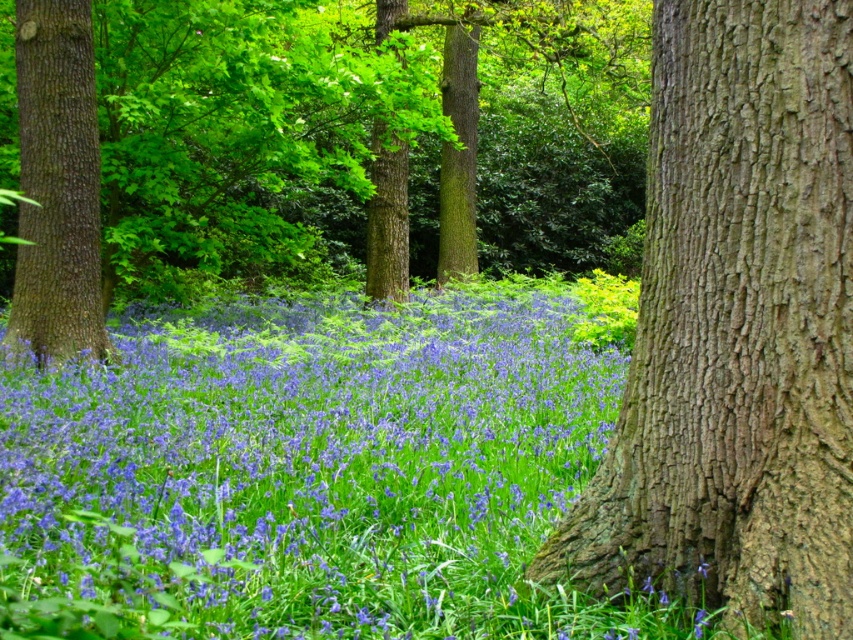
Question: Can you confirm if blue matte flowers at center is smaller than smooth brown bark at center?

Choices:
 (A) yes
 (B) no

Answer: (B)

Question: Which point is closer to the camera?

Choices:
 (A) smooth brown tree trunk at center
 (B) smooth brown bark at center
 (C) blue matte flowers at center
 (D) smooth brown tree trunk at left

Answer: (C)

Question: Which of the following is the farthest from the observer?

Choices:
 (A) (42, 51)
 (B) (751, 147)
 (C) (419, 115)

Answer: (C)

Question: Among these objects, which one is farthest from the camera?

Choices:
 (A) blue matte flowers at center
 (B) smooth brown tree trunk at center
 (C) smooth brown bark at center

Answer: (B)

Question: Does blue matte flowers at center appear on the right side of smooth brown tree trunk at left?

Choices:
 (A) no
 (B) yes

Answer: (B)

Question: Does smooth brown tree trunk at center have a greater width compared to smooth brown bark at center?

Choices:
 (A) yes
 (B) no

Answer: (A)